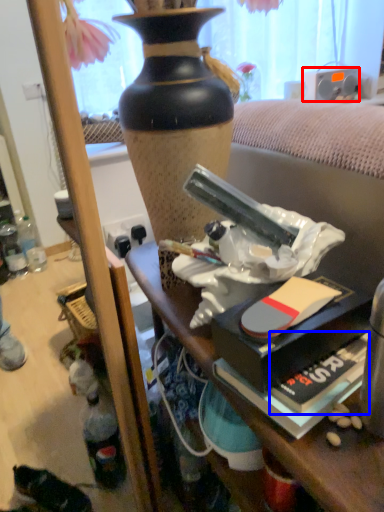
Question: Which object appears closest to the camera in this image, loudspeaker (highlighted by a red box) or paperback book (highlighted by a blue box)?

Choices:
 (A) loudspeaker
 (B) paperback book

Answer: (B)